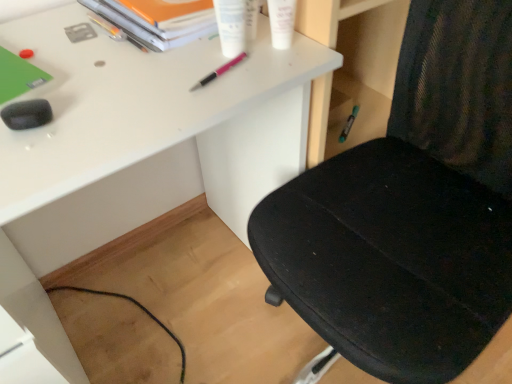
You are a GUI agent. You are given a task and a screenshot of the screen. Output one action in this format:
    pyautogui.click(x=<x>, y=<y>)
    Task: Click on the free space in front of orange matte paper at upper center
    
    Given the screenshot: What is the action you would take?
    pyautogui.click(x=153, y=72)